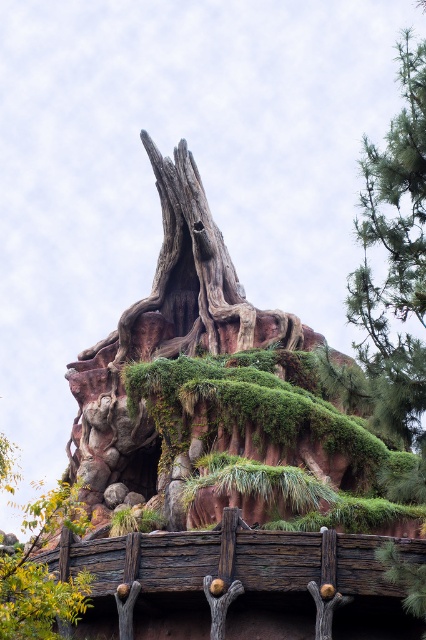
You are standing at the center of the image and want to walk towards the wooden rail at lower center. In which direction should you move?

You should move downward and to the right since the wooden rail at lower center is located at point [235,582], which is in the lower right direction from the center of the image.

You are a hiker trying to cross a narrow wooden rail at lower center. There is a green mossy tree at lower left nearby. Can you safely walk across the rail if you know your average step width is 30 cm?

The wooden rail at lower center is narrower than the green mossy tree at lower left. Since the rail is narrower than the tree, but we don not have exact measurements, it is uncertain whether the rail is wide enough for your 30 cm step. Proceed with caution.